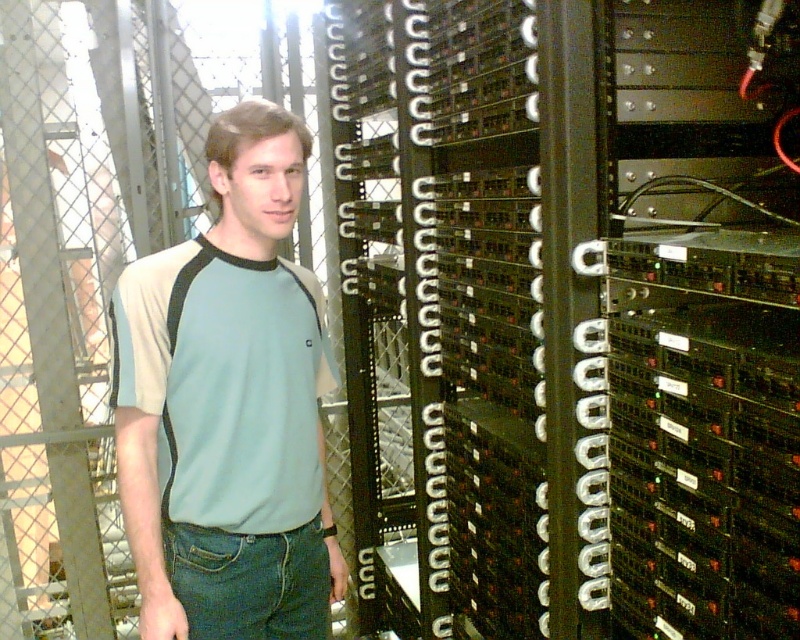
You are a technician who needs to access the black metal server rack at center. The tool you need is on a shelf 30 inches away from the camera. If you move from the tool to the rack, will you have to move forward or backward?

The black metal server rack at center is 32.51 inches away from the camera, while the tool is 30 inches away. Moving from the tool to the rack requires moving forward 2.51 inches.